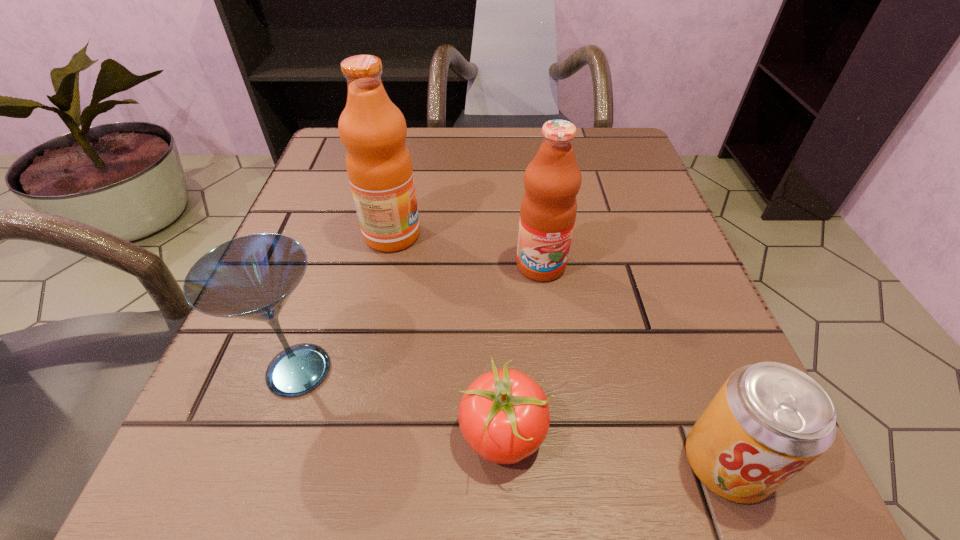
Find the location of `free location that satisfies the following two spatial constraints: 1. on the label side of the tomato; 2. on the right side of the taller fruit juice`. free location that satisfies the following two spatial constraints: 1. on the label side of the tomato; 2. on the right side of the taller fruit juice is located at coordinates (350, 433).

Find the location of a particular element. free space that satisfies the following two spatial constraints: 1. on the front label of the rightmost object; 2. on the left side of the right fruit juice is located at coordinates (568, 462).

Find the location of a particular element. The image size is (960, 540). vacant space that satisfies the following two spatial constraints: 1. on the front side of the martini; 2. on the right side of the tomato is located at coordinates (278, 433).